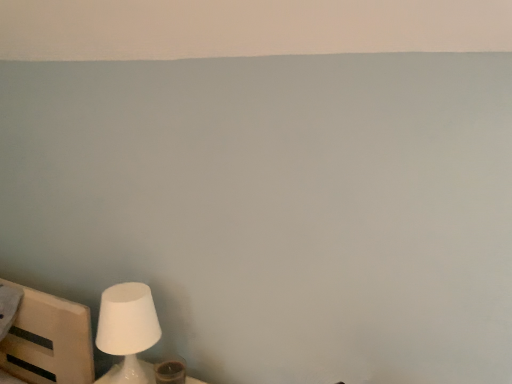
Question: Should I look upward or downward to see white matte lamp at lower left?

Choices:
 (A) down
 (B) up

Answer: (A)